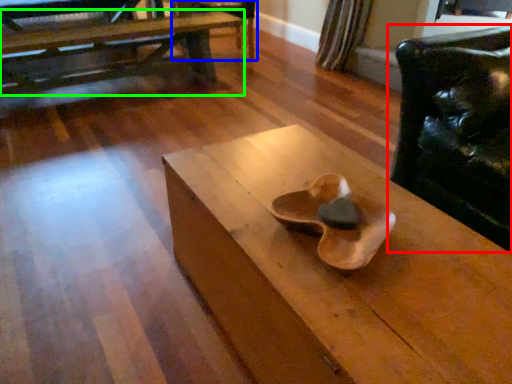
Question: Based on their relative distances, which object is farther from chair (highlighted by a red box)? Choose from armchair (highlighted by a blue box) and table (highlighted by a green box).

Choices:
 (A) armchair
 (B) table

Answer: (B)